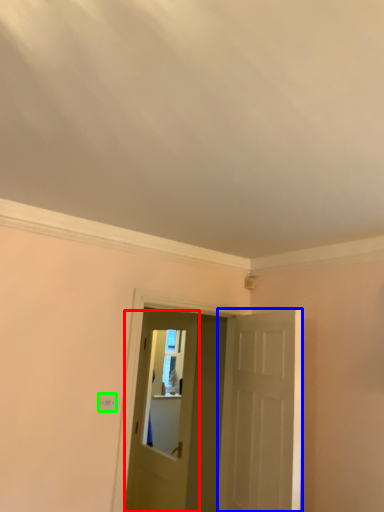
Question: Based on their relative distances, which object is farther from door (highlighted by a red box)? Choose from door (highlighted by a blue box) and light switch (highlighted by a green box).

Choices:
 (A) door
 (B) light switch

Answer: (B)